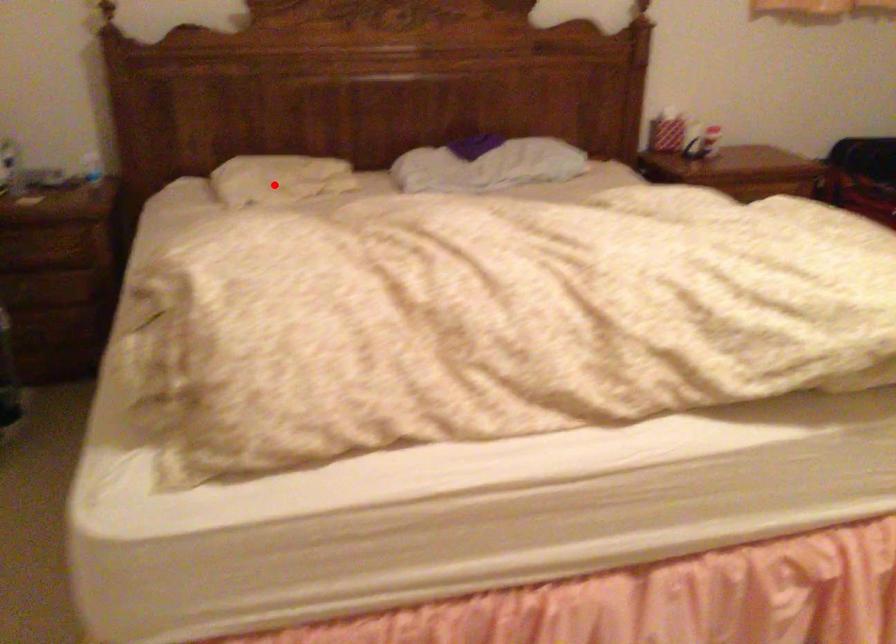
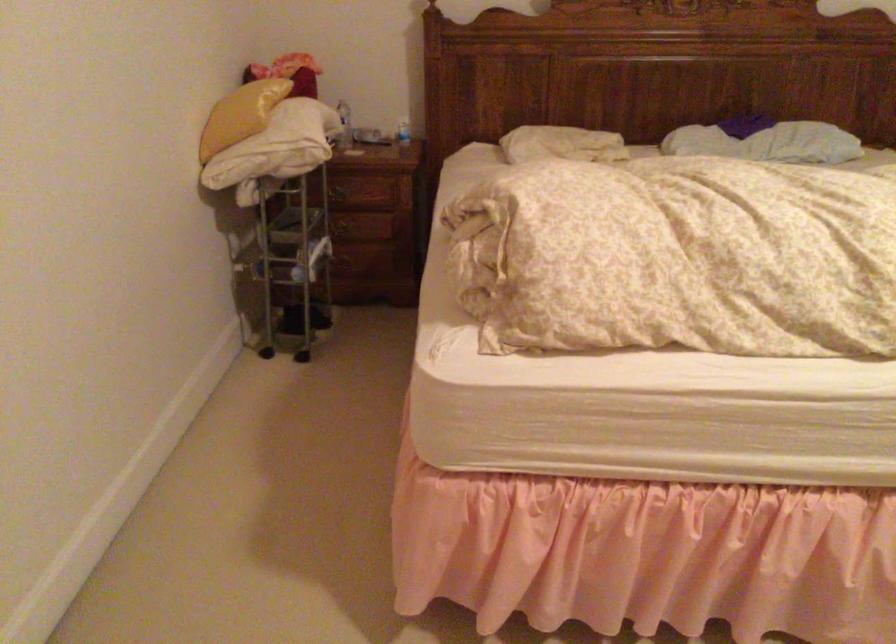
Question: I am providing you with two images of the same scene from different viewpoints. A red point is shown in image1. For the corresponding object point in image2, is it positioned nearer or farther from the camera?

Choices:
 (A) Nearer
 (B) Farther

Answer: (B)